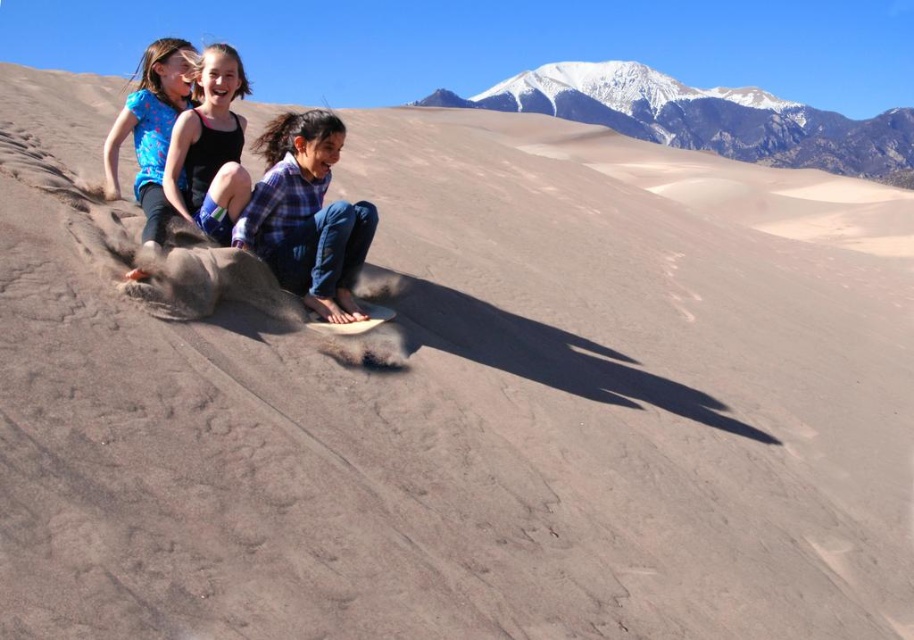
Between matte blue shorts at center and matte blue shirt at upper left, which one has more height?

matte blue shirt at upper left is taller.

Which is behind, point (190, 182) or point (155, 164)?

Point (155, 164)

Identify the location of matte blue shorts at center. The width and height of the screenshot is (914, 640). (210, 147).

In the scene shown: Is blue plaid shirt at center further to camera compared to matte blue shorts at center?

No.

Is point (303, 141) positioned in front of point (209, 131)?

Yes, point (303, 141) is in front of point (209, 131).

This screenshot has width=914, height=640. What are the coordinates of `blue plaid shirt at center` in the screenshot? It's located at (306, 216).

Who is higher up, snowy mountain at upper center or matte blue shirt at upper left?

snowy mountain at upper center

Between point (778, 145) and point (115, 186), which one is positioned in front?

Point (115, 186) is more forward.

The width and height of the screenshot is (914, 640). In order to click on snowy mountain at upper center in this screenshot , I will do `click(704, 116)`.